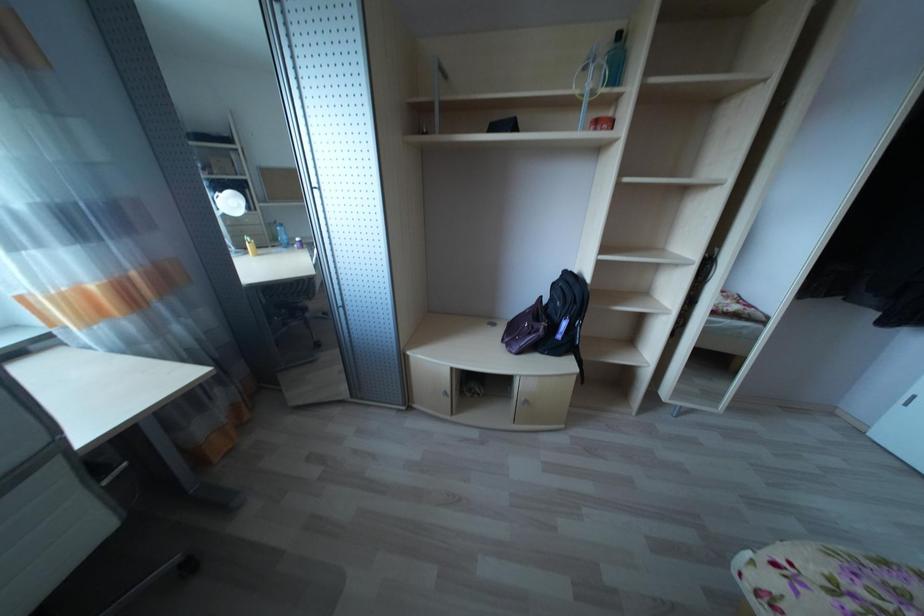
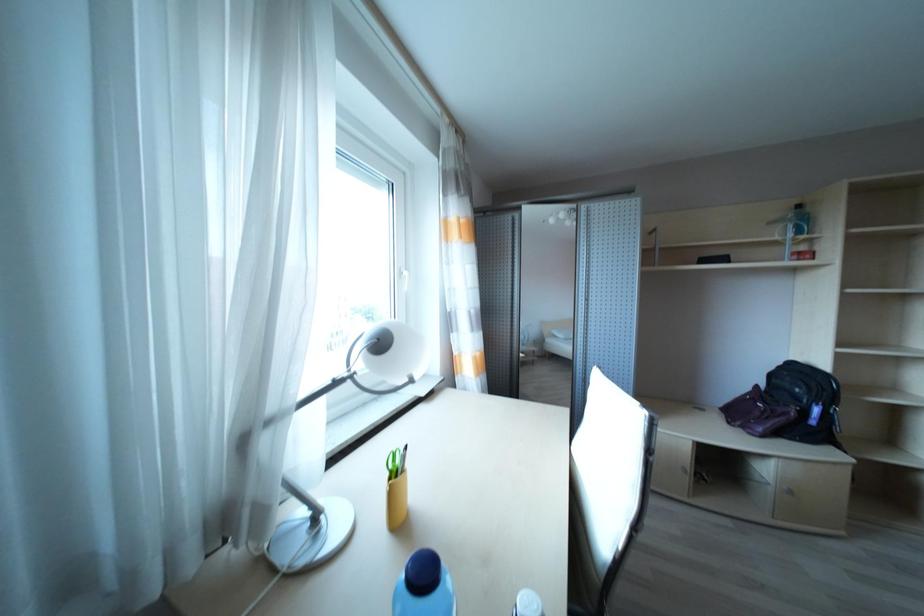
In a continuous first-person perspective shot, in which direction is the camera moving?

The movement direction of the cameraman is left, backward.